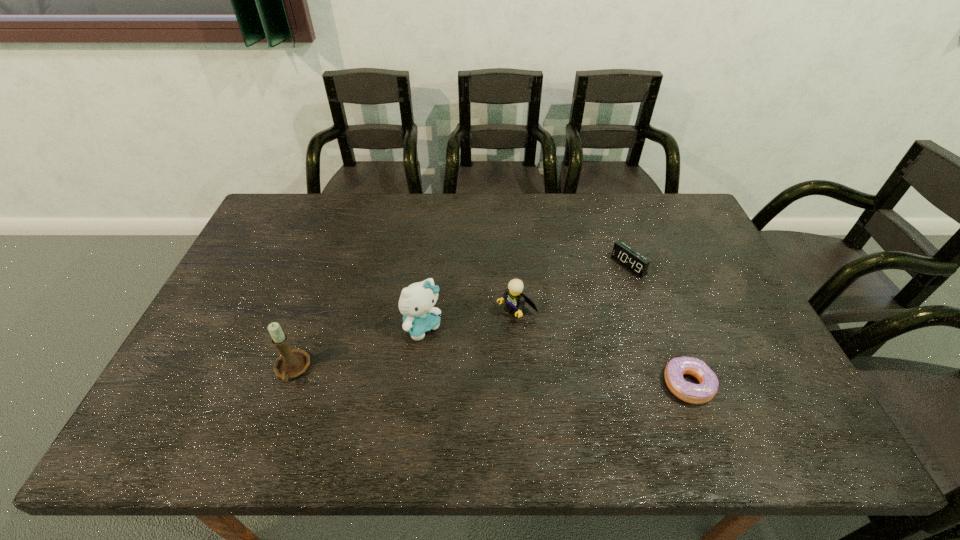
The width and height of the screenshot is (960, 540). I want to click on candle holder, so click(x=290, y=364).

You are a GUI agent. You are given a task and a screenshot of the screen. Output one action in this format:
    pyautogui.click(x=<x>, y=<y>)
    Task: Click on the shortest object
    This screenshot has height=540, width=960.
    Given the screenshot: What is the action you would take?
    pyautogui.click(x=689, y=392)

Identify the location of Lego. (515, 300).

What are the coordinates of `the third object from left to right` in the screenshot? It's located at (515, 300).

Identify the location of the second shortest object. (632, 260).

The width and height of the screenshot is (960, 540). In order to click on alarm clock in this screenshot , I will do `click(632, 260)`.

The height and width of the screenshot is (540, 960). I want to click on kitten, so click(416, 302).

At what (x,y) coordinates should I click in order to perform the action: click on vacant space positioned on the back of the doughnut. Please return your answer as a coordinate pair (x, y). This screenshot has height=540, width=960. Looking at the image, I should click on (644, 268).

Locate an element on the screen. This screenshot has width=960, height=540. free region located 0.280m on the front-facing side of the third object from right to left is located at coordinates (424, 383).

What are the coordinates of `vacant space positioned 0.050m on the front-facing side of the third object from right to left` in the screenshot? It's located at pyautogui.click(x=491, y=330).